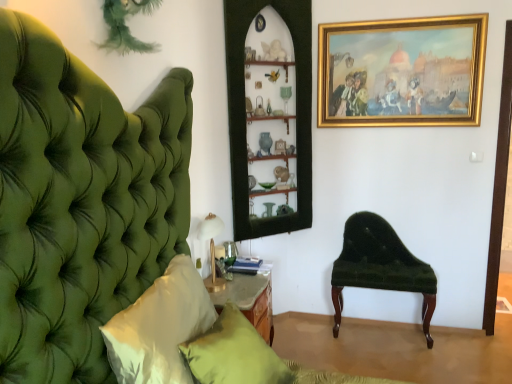
In the scene shown: Measure the distance between white satin pillow at left, which is the second pillow from back to front, and camera.

The distance of white satin pillow at left, which is the second pillow from back to front, from camera is 1.31 meters.

Describe the element at coordinates (269, 113) in the screenshot. I see `wooden shelves at center` at that location.

Describe the element at coordinates (212, 250) in the screenshot. The image size is (512, 384). I see `gold metallic table lamp at lower left` at that location.

This screenshot has width=512, height=384. What are the coordinates of `matte green pillow at lower center, which appears as the first pillow when viewed from the back` in the screenshot? It's located at (234, 353).

This screenshot has width=512, height=384. What do you see at coordinates (402, 72) in the screenshot?
I see `gold/gilded picture frame at upper right` at bounding box center [402, 72].

This screenshot has height=384, width=512. What are the coordinates of `gold/gilded picture frame at upper right` in the screenshot? It's located at (402, 72).

You are a GUI agent. You are given a task and a screenshot of the screen. Output one action in this format:
    pyautogui.click(x=<x>, y=<y>)
    Task: Click on the white satin pillow at left, the 1th pillow viewed from the front
    This screenshot has height=384, width=512.
    Given the screenshot: What is the action you would take?
    pyautogui.click(x=160, y=327)

From the image's perspective, is white satin pillow at left, the 1th pillow viewed from the front, above gold/gilded picture frame at upper right?

Actually, white satin pillow at left, the 1th pillow viewed from the front, appears below gold/gilded picture frame at upper right in the image.

Is white satin pillow at left, the 1th pillow viewed from the front, at the right side of gold/gilded picture frame at upper right?

No.

Who is more distant, white satin pillow at left, the 1th pillow viewed from the front, or gold/gilded picture frame at upper right?

gold/gilded picture frame at upper right.

From a real-world perspective, which is physically below, white satin pillow at left, the 1th pillow viewed from the front, or gold/gilded picture frame at upper right?

From a 3D spatial view, white satin pillow at left, the 1th pillow viewed from the front, is below.

From the image's perspective, between wooden shelves at center and gold/gilded picture frame at upper right, which one is located above?

gold/gilded picture frame at upper right appears higher in the image.

Consider the image. From a real-world perspective, does wooden shelves at center stand above gold/gilded picture frame at upper right?

No, from a real-world perspective, wooden shelves at center is not above gold/gilded picture frame at upper right.

Is wooden shelves at center placed right next to white satin pillow at left, which is the second pillow from back to front?

No.

Consider the image. Is white satin pillow at left, the 1th pillow viewed from the front, surrounded by wooden shelves at center?

No, white satin pillow at left, the 1th pillow viewed from the front, is not surrounded by wooden shelves at center.

How many degrees apart are the facing directions of wooden shelves at center and white satin pillow at left, which is the second pillow from back to front?

48.5 degrees separate the facing orientations of wooden shelves at center and white satin pillow at left, which is the second pillow from back to front.

From the picture: Is wooden shelves at center at the right side of velvet green bench at right?

Incorrect, wooden shelves at center is not on the right side of velvet green bench at right.

Looking at the image, does wooden shelves at center seem bigger or smaller compared to velvet green bench at right?

Considering their sizes, wooden shelves at center takes up more space than velvet green bench at right.

How different are the orientations of wooden shelves at center and velvet green bench at right in degrees?

43.7 degrees separate the facing orientations of wooden shelves at center and velvet green bench at right.

Is wooden shelves at center looking in the opposite direction of velvet green bench at right?

No.

From the image's perspective, is gold/gilded picture frame at upper right located beneath matte green pillow at lower center, which appears as the first pillow when viewed from the back?

Incorrect, from the image's perspective, gold/gilded picture frame at upper right is higher than matte green pillow at lower center, which appears as the first pillow when viewed from the back.

Is gold/gilded picture frame at upper right placed right next to matte green pillow at lower center, acting as the second pillow starting from the front?

No, gold/gilded picture frame at upper right is not next to matte green pillow at lower center, acting as the second pillow starting from the front.

Is gold/gilded picture frame at upper right positioned in front of matte green pillow at lower center, acting as the second pillow starting from the front?

No, it is not.

Would you say gold/gilded picture frame at upper right contains matte green pillow at lower center, acting as the second pillow starting from the front?

No, matte green pillow at lower center, acting as the second pillow starting from the front, is located outside of gold/gilded picture frame at upper right.

Is matte green pillow at lower center, which appears as the first pillow when viewed from the back, located within velvet green bench at right?

Definitely not — matte green pillow at lower center, which appears as the first pillow when viewed from the back, is not inside velvet green bench at right.

Which of these two, velvet green bench at right or matte green pillow at lower center, which appears as the first pillow when viewed from the back, is thinner?

velvet green bench at right is thinner.

Is velvet green bench at right with matte green pillow at lower center, which appears as the first pillow when viewed from the back?

There is a gap between velvet green bench at right and matte green pillow at lower center, which appears as the first pillow when viewed from the back.

Image resolution: width=512 pixels, height=384 pixels. In order to click on chair located on the right of matte green pillow at lower center, acting as the second pillow starting from the front in this screenshot , I will do `click(380, 266)`.

Is matte green pillow at lower center, which appears as the first pillow when viewed from the back, smaller than white satin pillow at left, the 1th pillow viewed from the front?

Actually, matte green pillow at lower center, which appears as the first pillow when viewed from the back, might be larger than white satin pillow at left, the 1th pillow viewed from the front.

Can you tell me how much matte green pillow at lower center, acting as the second pillow starting from the front, and white satin pillow at left, the 1th pillow viewed from the front, differ in facing direction?

1.52 degrees.

Is matte green pillow at lower center, acting as the second pillow starting from the front, taller or shorter than white satin pillow at left, the 1th pillow viewed from the front?

In the image, matte green pillow at lower center, acting as the second pillow starting from the front, appears to be shorter than white satin pillow at left, the 1th pillow viewed from the front.

Does point (245, 331) come closer to viewer compared to point (172, 265)?

Yes, point (245, 331) is in front of point (172, 265).

You are a GUI agent. You are given a task and a screenshot of the screen. Output one action in this format:
    pyautogui.click(x=<x>, y=<y>)
    Task: Click on the picture frame on the right of white satin pillow at left, the 1th pillow viewed from the front
    Image resolution: width=512 pixels, height=384 pixels.
    Given the screenshot: What is the action you would take?
    402,72

At what (x,y) coordinates should I click in order to perform the action: click on picture frame located above the wooden shelves at center (from a real-world perspective). Please return your answer as a coordinate pair (x, y). Looking at the image, I should click on (402, 72).

From the image, which object appears to be nearer to gold metallic table lamp at lower left, wooden shelves at center or gold/gilded picture frame at upper right?

wooden shelves at center is closer to gold metallic table lamp at lower left.

Based on their spatial positions, is wooden shelves at center or white satin pillow at left, the 1th pillow viewed from the front, closer to gold/gilded picture frame at upper right?

wooden shelves at center.

Estimate the real-world distances between objects in this image. Which object is closer to velvet green bench at right, matte green pillow at lower center, which appears as the first pillow when viewed from the back, or gold metallic table lamp at lower left?

gold metallic table lamp at lower left is closer to velvet green bench at right.

Estimate the real-world distances between objects in this image. Which object is further from gold metallic table lamp at lower left, wooden shelves at center or matte green pillow at lower center, acting as the second pillow starting from the front?

wooden shelves at center lies further to gold metallic table lamp at lower left than the other object.

Considering their positions, is white satin pillow at left, the 1th pillow viewed from the front, positioned closer to wooden shelves at center than gold metallic table lamp at lower left?

Among the two, gold metallic table lamp at lower left is located nearer to wooden shelves at center.

When comparing their distances from gold/gilded picture frame at upper right, does matte green pillow at lower center, which appears as the first pillow when viewed from the back, or wooden shelves at center seem closer?

The object closer to gold/gilded picture frame at upper right is wooden shelves at center.

Estimate the real-world distances between objects in this image. Which object is further from velvet green bench at right, gold metallic table lamp at lower left or gold/gilded picture frame at upper right?

gold metallic table lamp at lower left is positioned further to the anchor velvet green bench at right.

Estimate the real-world distances between objects in this image. Which object is closer to matte green pillow at lower center, acting as the second pillow starting from the front, gold/gilded picture frame at upper right or white satin pillow at left, which is the second pillow from back to front?

white satin pillow at left, which is the second pillow from back to front, is positioned closer to the anchor matte green pillow at lower center, acting as the second pillow starting from the front.

Find the location of a particular element. The height and width of the screenshot is (384, 512). table lamp between white satin pillow at left, the 1th pillow viewed from the front, and velvet green bench at right in the front-back direction is located at coordinates (212, 250).

Find the location of `chair between gold/gilded picture frame at upper right and matte green pillow at lower center, which appears as the first pillow when viewed from the back, from top to bottom`. chair between gold/gilded picture frame at upper right and matte green pillow at lower center, which appears as the first pillow when viewed from the back, from top to bottom is located at coordinates (380, 266).

The image size is (512, 384). Find the location of `table lamp located between white satin pillow at left, the 1th pillow viewed from the front, and matte green pillow at lower center, which appears as the first pillow when viewed from the back, in the depth direction`. table lamp located between white satin pillow at left, the 1th pillow viewed from the front, and matte green pillow at lower center, which appears as the first pillow when viewed from the back, in the depth direction is located at coordinates (212, 250).

Find the location of a particular element. table lamp between wooden shelves at center and matte green pillow at lower center, acting as the second pillow starting from the front, in the up-down direction is located at coordinates (212, 250).